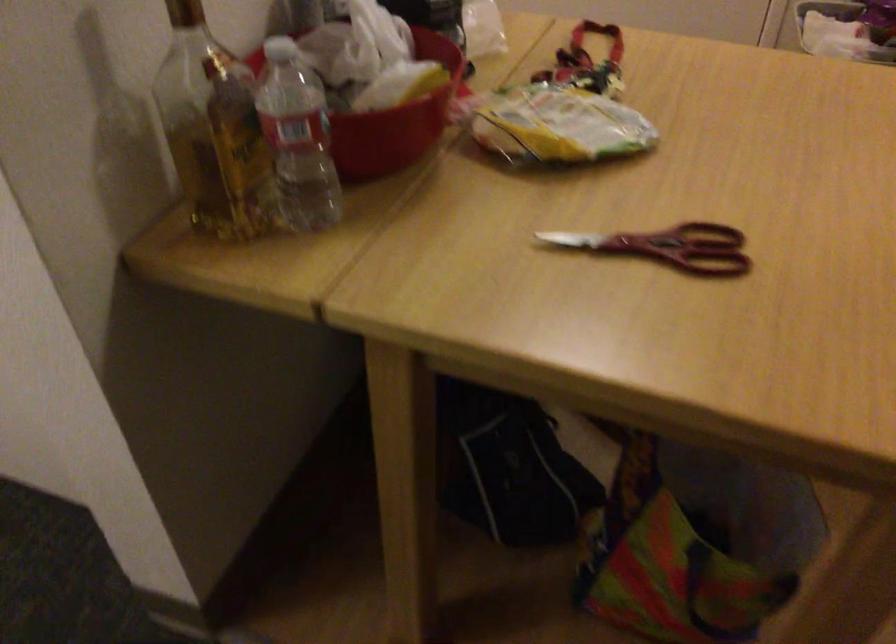
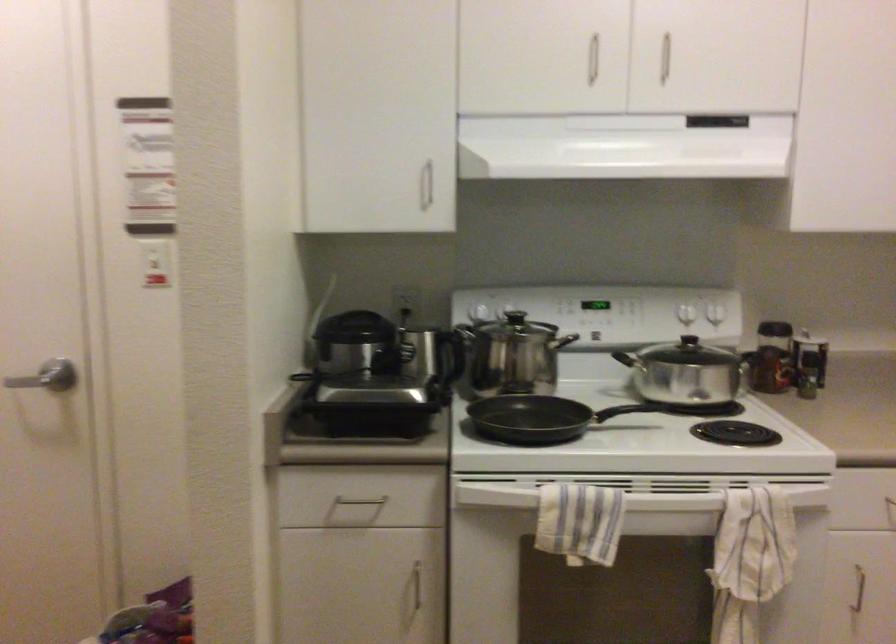
The first image is from the beginning of the video and the second image is from the end. How did the camera likely rotate when shooting the video?

The camera rotated toward right-up.